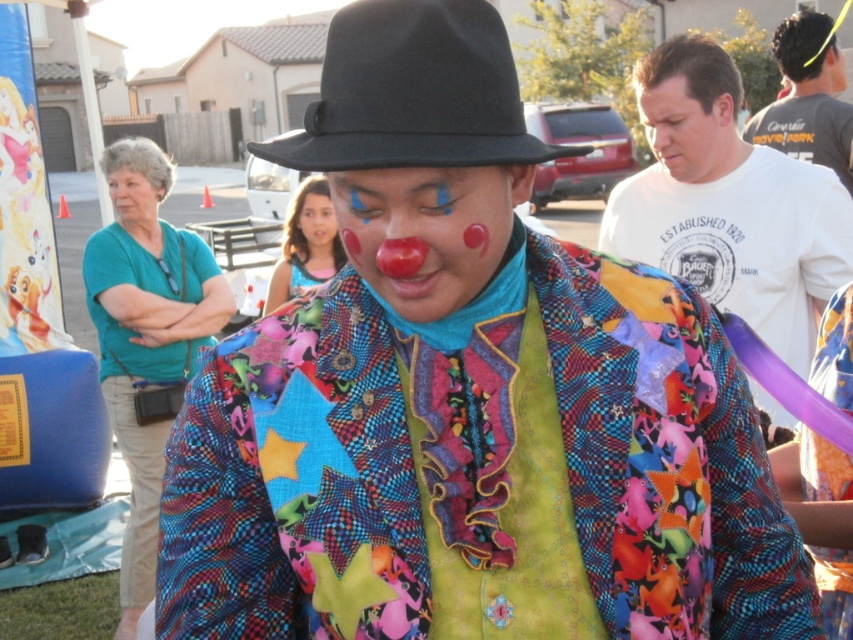
Does white cotton t-shirt at upper right have a smaller size compared to matte clown nose at center?

Incorrect, white cotton t-shirt at upper right is not smaller in size than matte clown nose at center.

Which is in front, point (693, 131) or point (367, 180)?

Positioned in front is point (367, 180).

Image resolution: width=853 pixels, height=640 pixels. In order to click on white cotton t-shirt at upper right in this screenshot , I will do `click(728, 202)`.

Identify the location of white cotton t-shirt at upper right. (728, 202).

Can you confirm if white cotton t-shirt at upper right is taller than gray cotton t-shirt at upper right?

Yes, white cotton t-shirt at upper right is taller than gray cotton t-shirt at upper right.

Looking at this image, who is more distant from viewer, (x=701, y=284) or (x=759, y=132)?

Point (x=759, y=132)

The image size is (853, 640). I want to click on white cotton t-shirt at upper right, so click(x=728, y=202).

Which of these two, white cotton t-shirt at upper right or smooth skin face at upper right, stands taller?

With more height is white cotton t-shirt at upper right.

Does white cotton t-shirt at upper right have a larger size compared to smooth skin face at upper right?

Yes.

Is point (804, 256) closer to camera compared to point (724, 104)?

That is True.

The width and height of the screenshot is (853, 640). Identify the location of white cotton t-shirt at upper right. (728, 202).